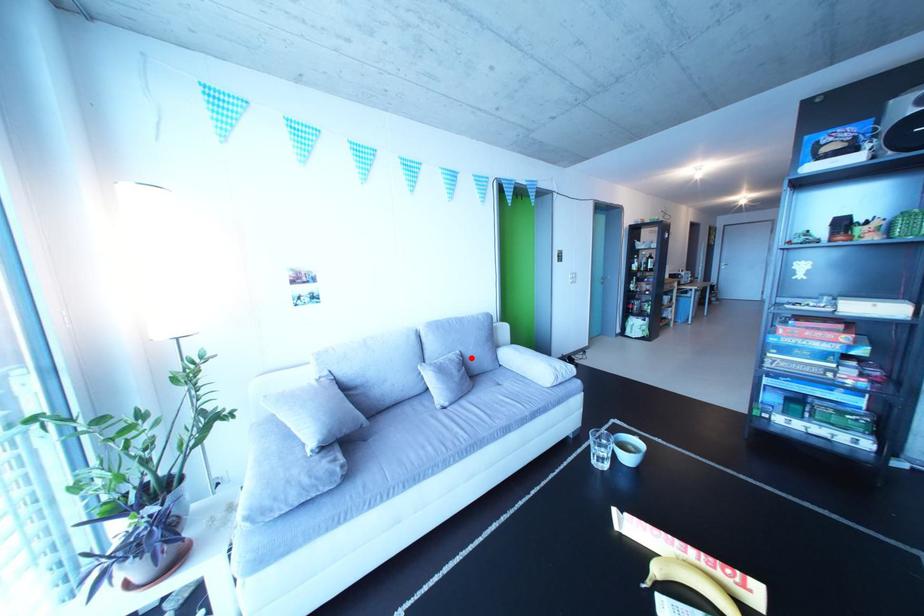
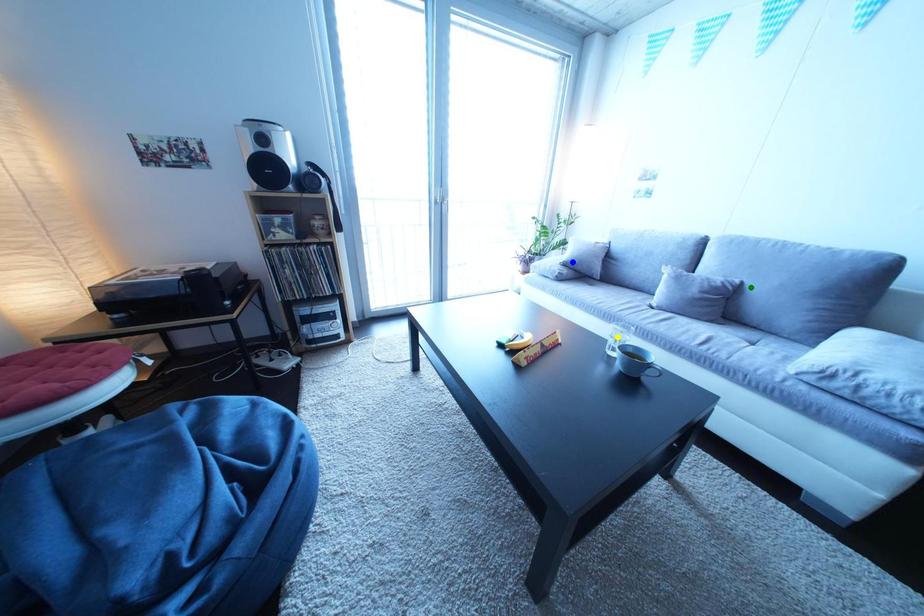
Question: I am providing you with two images of the same scene from different viewpoints. A red point is marked on the first image. You are given multiple points on the second image. Which spot in image 2 lines up with the point in image 1?

Choices:
 (A) green point
 (B) blue point
 (C) yellow point

Answer: (A)